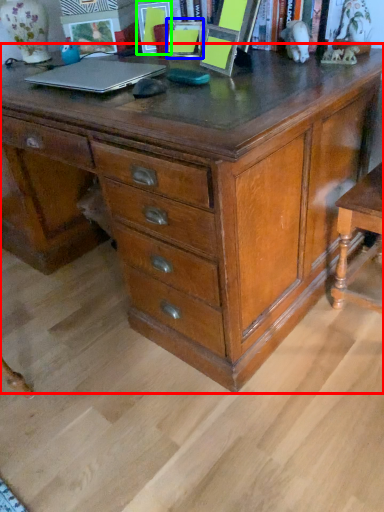
Question: Estimate the real-world distances between objects in this image. Which object is farther from chest of drawers (highlighted by a red box), picture frame (highlighted by a blue box) or picture frame (highlighted by a green box)?

Choices:
 (A) picture frame
 (B) picture frame

Answer: (B)